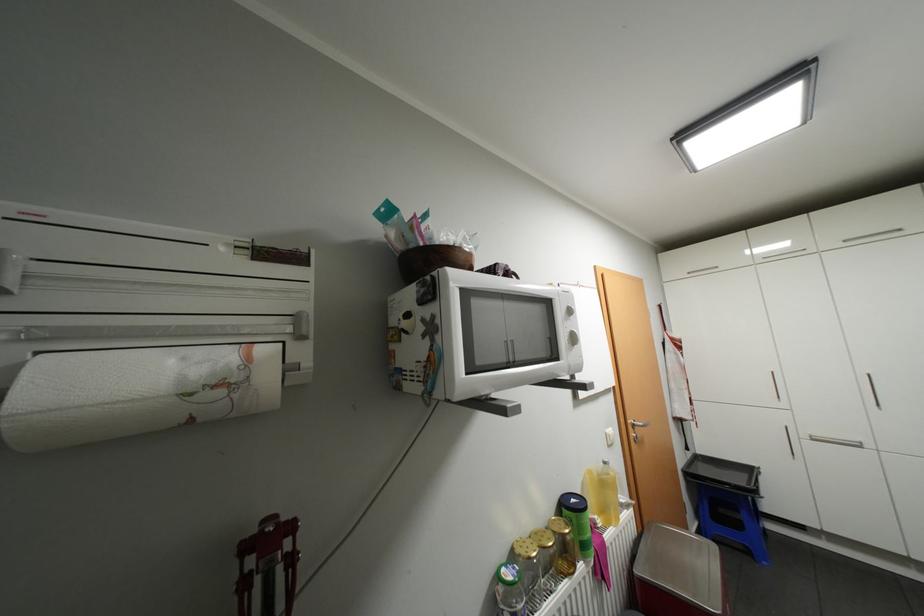
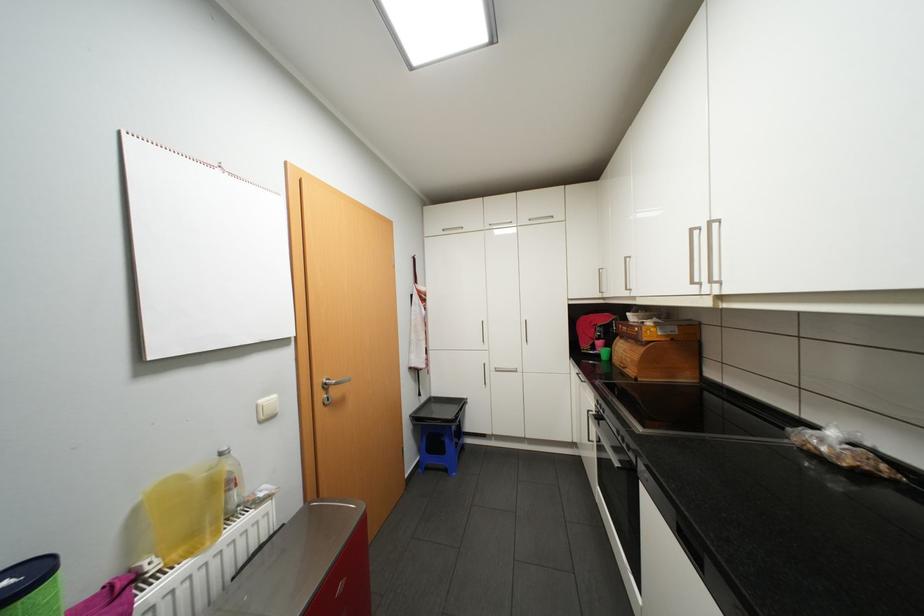
Question: The images are taken continuously from a first-person perspective. In which direction is your viewpoint rotating?

Choices:
 (A) Left
 (B) Right
 (C) Up
 (D) Down

Answer: (B)